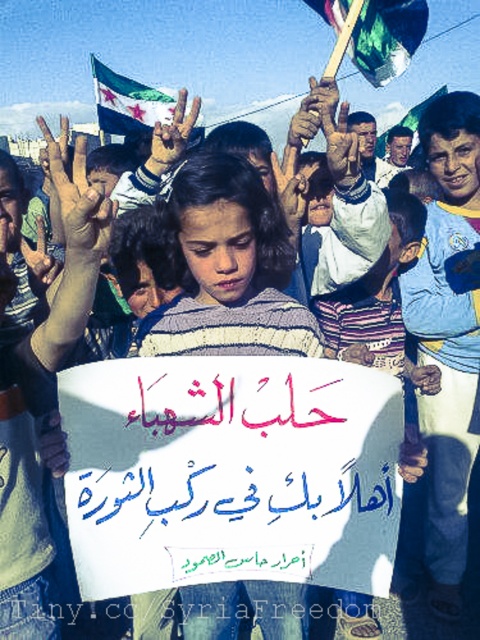
In the protest scene, you notice a striped sweater at center and a brown leather hand at center. Which object is wider?

The striped sweater at center is wider than the brown leather hand at center.

You are a photographer trying to capture a closeup shot of the striped sweater at center and the brown dirt hand at upper center in the protest scene. Based on their distance, can you fit both subjects into a single frame without moving the camera? The camera has a 50mm lens which has a field of view of 46 degrees.

The striped sweater at center is 14.71 inches from the brown dirt hand at upper center. Since the camera with a 50mm lens has a field of view of 46 degrees, which can accommodate subjects within that angle, both subjects can likely be captured in a single frame without moving the camera.